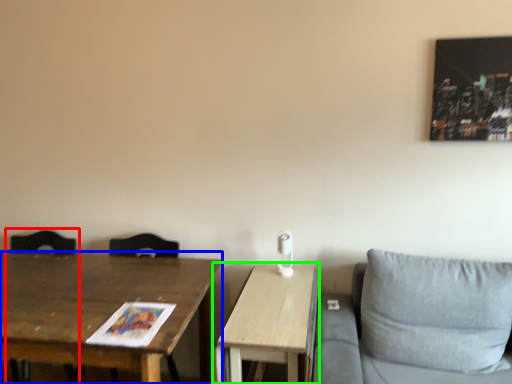
Question: Considering the real-world distances, which object is farthest from swivel chair (highlighted by a red box)? table (highlighted by a blue box) or table (highlighted by a green box)?

Choices:
 (A) table
 (B) table

Answer: (B)